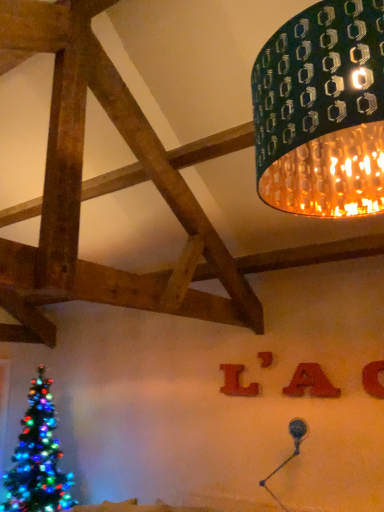
Question: Should I look upward or downward to see matte red letter at center, which appears as the 3th alphabet when viewed from the front?

Choices:
 (A) down
 (B) up

Answer: (A)

Question: Is green textured lampshade at upper right positioned far away from red felt letter a at upper center, the 2th alphabet in the front-to-back sequence?

Choices:
 (A) no
 (B) yes

Answer: (B)

Question: From the image's perspective, does green textured lampshade at upper right appear lower than red felt letter a at upper center, the 2th alphabet in the front-to-back sequence?

Choices:
 (A) no
 (B) yes

Answer: (A)

Question: Is the position of green textured lampshade at upper right less distant than that of red felt letter a at upper center, the second alphabet from the right?

Choices:
 (A) yes
 (B) no

Answer: (A)

Question: Is the surface of green textured lampshade at upper right in direct contact with red felt letter a at upper center, the second alphabet from the right?

Choices:
 (A) no
 (B) yes

Answer: (A)

Question: Considering the relative sizes of green textured lampshade at upper right and red felt letter a at upper center, the second alphabet from the right, in the image provided, is green textured lampshade at upper right smaller than red felt letter a at upper center, the second alphabet from the right,?

Choices:
 (A) no
 (B) yes

Answer: (A)

Question: Is green textured lampshade at upper right bigger than red felt letter a at upper center, the second alphabet from the right?

Choices:
 (A) no
 (B) yes

Answer: (B)

Question: Would you say metallic silver table lamp at lower right is part of matte red letter at upper center's contents?

Choices:
 (A) no
 (B) yes

Answer: (A)

Question: From a real-world perspective, is matte red letter at upper center physically above metallic silver table lamp at lower right?

Choices:
 (A) yes
 (B) no

Answer: (A)

Question: Is the depth of matte red letter at upper center less than that of metallic silver table lamp at lower right?

Choices:
 (A) yes
 (B) no

Answer: (B)

Question: Considering the relative sizes of matte red letter at upper center and metallic silver table lamp at lower right in the image provided, is matte red letter at upper center shorter than metallic silver table lamp at lower right?

Choices:
 (A) no
 (B) yes

Answer: (B)

Question: Does matte red letter at upper center have a greater height compared to metallic silver table lamp at lower right?

Choices:
 (A) yes
 (B) no

Answer: (B)

Question: Could you tell me if matte red letter at upper center is turned towards metallic silver table lamp at lower right?

Choices:
 (A) no
 (B) yes

Answer: (A)

Question: Can you confirm if red felt letter a at upper center, the second alphabet from the right, is thinner than matte red letter at upper center?

Choices:
 (A) yes
 (B) no

Answer: (B)